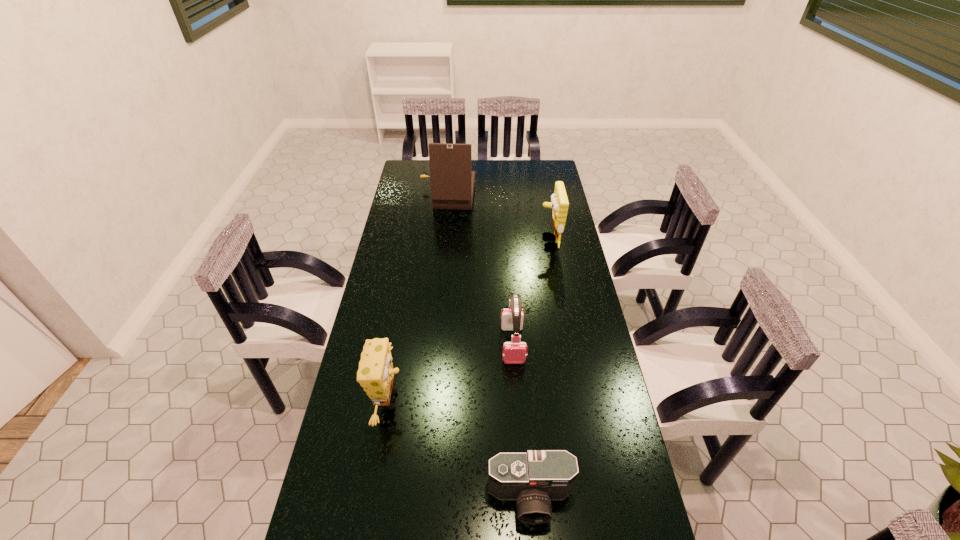
Identify the location of vacant area located 0.130m on the face of the right sponge. The image size is (960, 540). (508, 242).

Where is `vacant region located 0.260m on the face of the right sponge`? vacant region located 0.260m on the face of the right sponge is located at coordinates (477, 242).

This screenshot has width=960, height=540. I want to click on vacant region located 0.320m on the face of the right sponge, so click(x=464, y=242).

Locate an element on the screen. The height and width of the screenshot is (540, 960). free region located on the face of the left sponge is located at coordinates (429, 400).

Find the location of `vacant position located on the outer surface of the earphone`. vacant position located on the outer surface of the earphone is located at coordinates (517, 413).

Find the location of a particular element. The image size is (960, 540). object situated at the far edge is located at coordinates (452, 180).

At what (x,y) coordinates should I click in order to perform the action: click on phonograph record present at the left edge. Please return your answer as a coordinate pair (x, y). This screenshot has height=540, width=960. Looking at the image, I should click on (452, 180).

The height and width of the screenshot is (540, 960). In order to click on sponge present at the left edge in this screenshot , I will do `click(375, 374)`.

I want to click on object that is at the right edge, so click(559, 204).

The height and width of the screenshot is (540, 960). I want to click on object present at the far left corner, so click(452, 180).